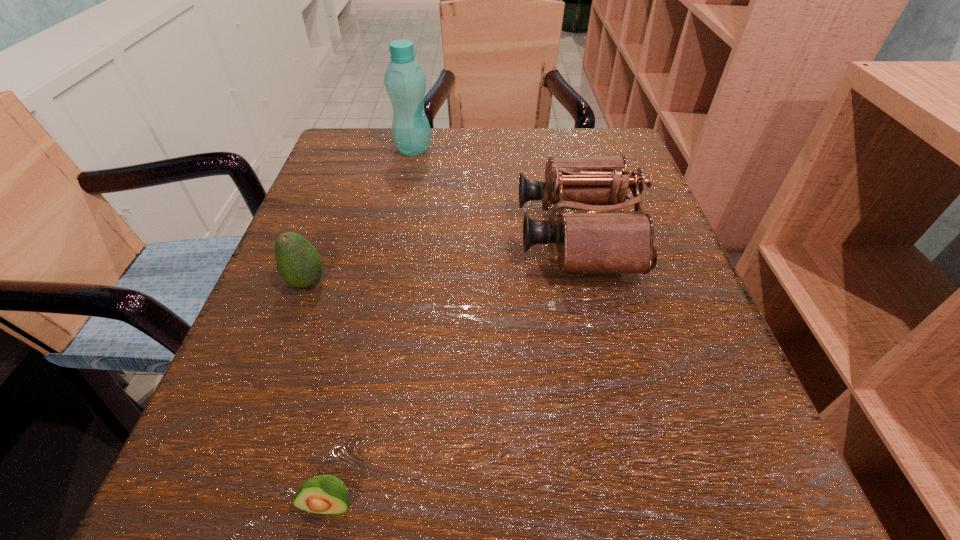
Where is `the tallest object`? The height and width of the screenshot is (540, 960). the tallest object is located at coordinates (405, 81).

Identify the location of the farthest object. 405,81.

This screenshot has height=540, width=960. What are the coordinates of `binoculars` in the screenshot? It's located at (601, 239).

Locate an element on the screen. This screenshot has height=540, width=960. the rightmost object is located at coordinates (601, 239).

Find the location of `the farther avocado`. the farther avocado is located at coordinates (299, 264).

Image resolution: width=960 pixels, height=540 pixels. I want to click on the left avocado, so click(299, 264).

Identify the location of the nearest object. This screenshot has width=960, height=540. (324, 494).

The image size is (960, 540). Find the location of `the shorter avocado`. the shorter avocado is located at coordinates (324, 494).

The width and height of the screenshot is (960, 540). Identify the location of free spot located 0.190m on the right of the tallest object. (517, 149).

This screenshot has height=540, width=960. Find the location of `vacant area located through the eyepieces of the binoculars`. vacant area located through the eyepieces of the binoculars is located at coordinates (401, 235).